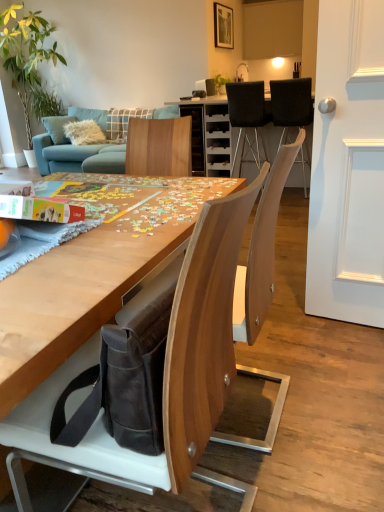
Identify the location of wooden chair at center, which ranks as the first chair in front-to-back order. (204, 341).

In order to face black fabric chair at upper right, the second chair when ordered from front to back, should I rotate leftwards or rightwards?

A 13.463 degree turn to the right will do.

Locate an element on the screen. The height and width of the screenshot is (512, 384). matte white cabinet at upper center is located at coordinates (272, 29).

What do you see at coordinates (272, 29) in the screenshot? I see `matte white cabinet at upper center` at bounding box center [272, 29].

Describe the element at coordinates (247, 113) in the screenshot. I see `black fabric chair at upper center, which ranks as the 3th chair in front-to-back order` at that location.

Identify the location of teal fabric couch at upper left. (78, 156).

Is point (88, 151) closer or farther from the camera than point (305, 89)?

Point (88, 151).

Is teal fabric couch at upper left taller than black fabric chair at upper right, the 2th chair in the back-to-front sequence?

Correct, teal fabric couch at upper left is much taller as black fabric chair at upper right, the 2th chair in the back-to-front sequence.

Is teal fabric couch at upper left oriented towards black fabric chair at upper right, positioned as the 1th chair in top-to-bottom order?

No, teal fabric couch at upper left is not oriented towards black fabric chair at upper right, positioned as the 1th chair in top-to-bottom order.

Considering the sizes of objects teal fabric couch at upper left and black fabric chair at upper right, marked as the 3th chair in a bottom-to-top arrangement, in the image provided, who is bigger, teal fabric couch at upper left or black fabric chair at upper right, marked as the 3th chair in a bottom-to-top arrangement,?

With larger size is teal fabric couch at upper left.

Is black fabric chair at upper right, positioned as the 1th chair in top-to-bottom order, completely or partially outside of green leafy plant at upper left?

black fabric chair at upper right, positioned as the 1th chair in top-to-bottom order, lies outside green leafy plant at upper left's area.

How different are the orientations of black fabric chair at upper right, positioned as the 1th chair in top-to-bottom order, and green leafy plant at upper left in degrees?

The angle between the facing direction of black fabric chair at upper right, positioned as the 1th chair in top-to-bottom order, and the facing direction of green leafy plant at upper left is 179 degrees.

Where is `houseplant that appears on the left of black fabric chair at upper right, the 2th chair in the back-to-front sequence`? houseplant that appears on the left of black fabric chair at upper right, the 2th chair in the back-to-front sequence is located at coordinates (25, 53).

Considering the sizes of objects black fabric chair at upper right, the second chair when ordered from front to back, and green leafy plant at upper left in the image provided, who is thinner, black fabric chair at upper right, the second chair when ordered from front to back, or green leafy plant at upper left?

Thinner between the two is black fabric chair at upper right, the second chair when ordered from front to back.

Is teal fabric couch at upper left further to the viewer compared to matte white cabinet at upper center?

No, it is in front of matte white cabinet at upper center.

Considering the sizes of objects teal fabric couch at upper left and matte white cabinet at upper center in the image provided, who is wider, teal fabric couch at upper left or matte white cabinet at upper center?

teal fabric couch at upper left is wider.

Is teal fabric couch at upper left positioned with its back to matte white cabinet at upper center?

That's not correct — teal fabric couch at upper left is not looking away from matte white cabinet at upper center.

Considering the positions of objects teal fabric couch at upper left and matte white cabinet at upper center in the image provided, who is more to the right, teal fabric couch at upper left or matte white cabinet at upper center?

matte white cabinet at upper center.

Is point (281, 22) positioned behind point (304, 115)?

Yes.

Looking at their sizes, would you say matte white cabinet at upper center is wider or thinner than black fabric chair at upper right, the 2th chair in the back-to-front sequence?

matte white cabinet at upper center is thinner than black fabric chair at upper right, the 2th chair in the back-to-front sequence.

How much distance is there between matte white cabinet at upper center and black fabric chair at upper right, which appears as the 3th chair when viewed from the left?

matte white cabinet at upper center is 8.62 feet from black fabric chair at upper right, which appears as the 3th chair when viewed from the left.

From the image's perspective, is matte white cabinet at upper center above or below black fabric chair at upper right, which appears as the 3th chair when viewed from the left?

Clearly, from the image's perspective, matte white cabinet at upper center is above black fabric chair at upper right, which appears as the 3th chair when viewed from the left.

Can you confirm if wooden chair at center, which ranks as the 1th chair in bottom-to-top order, is thinner than green leafy plant at upper left?

Correct, the width of wooden chair at center, which ranks as the 1th chair in bottom-to-top order, is less than that of green leafy plant at upper left.

Could green leafy plant at upper left be considered to be inside wooden chair at center, acting as the first chair starting from the left?

No, green leafy plant at upper left is not surrounded by wooden chair at center, acting as the first chair starting from the left.

Considering the sizes of objects wooden chair at center, which ranks as the 1th chair in bottom-to-top order, and green leafy plant at upper left in the image provided, who is shorter, wooden chair at center, which ranks as the 1th chair in bottom-to-top order, or green leafy plant at upper left?

Standing shorter between the two is wooden chair at center, which ranks as the 1th chair in bottom-to-top order.

Would you say wooden chair at center, acting as the first chair starting from the left, is inside or outside teal fabric couch at upper left?

wooden chair at center, acting as the first chair starting from the left, is outside teal fabric couch at upper left.

From a real-world perspective, which is physically below, wooden chair at center, which is counted as the third chair, starting from the right, or teal fabric couch at upper left?

In real-world perspective, teal fabric couch at upper left is lower.

Would you consider wooden chair at center, which ranks as the 1th chair in bottom-to-top order, to be distant from teal fabric couch at upper left?

Yes, wooden chair at center, which ranks as the 1th chair in bottom-to-top order, and teal fabric couch at upper left are quite far apart.

Starting from the green leafy plant at upper left, which chair is the 2nd one to the right? Please provide its 2D coordinates.

[(247, 113)]

Considering the relative sizes of green leafy plant at upper left and black fabric chair at upper center, marked as the 2th chair in a right-to-left arrangement, in the image provided, is green leafy plant at upper left bigger than black fabric chair at upper center, marked as the 2th chair in a right-to-left arrangement,?

Yes, green leafy plant at upper left is bigger than black fabric chair at upper center, marked as the 2th chair in a right-to-left arrangement.

Is the surface of green leafy plant at upper left in direct contact with black fabric chair at upper center, which ranks as the 3th chair in front-to-back order?

No, green leafy plant at upper left is not touching black fabric chair at upper center, which ranks as the 3th chair in front-to-back order.

Is green leafy plant at upper left at the right side of black fabric chair at upper center, the second chair from the left?

In fact, green leafy plant at upper left is to the left of black fabric chair at upper center, the second chair from the left.

Where is `the 1st chair positioned below the teal fabric couch at upper left (from the image's perspective)`? The height and width of the screenshot is (512, 384). the 1st chair positioned below the teal fabric couch at upper left (from the image's perspective) is located at coordinates (291, 104).

The height and width of the screenshot is (512, 384). In order to click on houseplant above the black fabric chair at upper right, the second chair when ordered from front to back (from a real-world perspective) in this screenshot , I will do `click(25, 53)`.

Which object lies nearer to the anchor point black fabric chair at upper right, which appears as the 3th chair when viewed from the left, wooden chair at center, the third chair positioned from the top, or green leafy plant at upper left?

wooden chair at center, the third chair positioned from the top.

Estimate the real-world distances between objects in this image. Which object is further from teal fabric couch at upper left, black fabric chair at upper right, the 2th chair in the back-to-front sequence, or green leafy plant at upper left?

black fabric chair at upper right, the 2th chair in the back-to-front sequence, is positioned further to the anchor teal fabric couch at upper left.

Considering their positions, is green leafy plant at upper left positioned further to teal fabric couch at upper left than wooden chair at center, which ranks as the first chair in front-to-back order?

Based on the image, wooden chair at center, which ranks as the first chair in front-to-back order, appears to be further to teal fabric couch at upper left.

From the image, which object appears to be farther from teal fabric couch at upper left, wooden chair at center, the third chair positioned from the top, or black fabric chair at upper center, which appears as the second chair when ordered from the bottom?

wooden chair at center, the third chair positioned from the top, is further to teal fabric couch at upper left.

Consider the image. Estimate the real-world distances between objects in this image. Which object is further from matte white cabinet at upper center, black fabric chair at upper right, marked as the 3th chair in a bottom-to-top arrangement, or green leafy plant at upper left?

green leafy plant at upper left is further to matte white cabinet at upper center.

Looking at the image, which one is located further to teal fabric couch at upper left, black fabric chair at upper center, marked as the 2th chair in a right-to-left arrangement, or wooden chair at center, which is the third chair from back to front?

Based on the image, wooden chair at center, which is the third chair from back to front, appears to be further to teal fabric couch at upper left.

From the picture: When comparing their distances from teal fabric couch at upper left, does black fabric chair at upper right, the 1th chair from the right, or black fabric chair at upper center, which is counted as the 2th chair, starting from the top, seem further?

black fabric chair at upper right, the 1th chair from the right, lies further to teal fabric couch at upper left than the other object.

Based on their spatial positions, is matte white cabinet at upper center or black fabric chair at upper center, which is counted as the 2th chair, starting from the top, further from wooden chair at center, which is the third chair from back to front?

The object further to wooden chair at center, which is the third chair from back to front, is matte white cabinet at upper center.

Image resolution: width=384 pixels, height=512 pixels. Find the location of `studio couch between green leafy plant at upper left and black fabric chair at upper center, which appears as the second chair when ordered from the bottom, in the horizontal direction`. studio couch between green leafy plant at upper left and black fabric chair at upper center, which appears as the second chair when ordered from the bottom, in the horizontal direction is located at coordinates (78, 156).

Find the location of a particular element. studio couch positioned between wooden chair at center, which is counted as the third chair, starting from the right, and green leafy plant at upper left from near to far is located at coordinates (78, 156).

At what (x,y) coordinates should I click in order to perform the action: click on studio couch positioned between wooden chair at center, which ranks as the first chair in front-to-back order, and matte white cabinet at upper center from near to far. Please return your answer as a coordinate pair (x, y). This screenshot has width=384, height=512. Looking at the image, I should click on (78, 156).

I want to click on chair positioned between wooden chair at center, which is counted as the third chair, starting from the right, and black fabric chair at upper center, marked as the 2th chair in a right-to-left arrangement, from near to far, so click(291, 104).